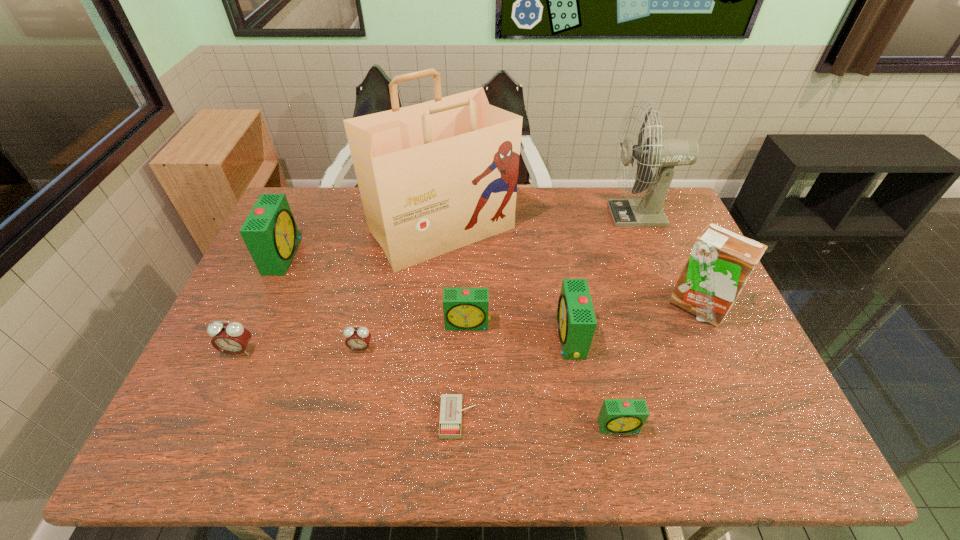
Find the location of a particular element. This screenshot has height=540, width=960. free region at the far left corner of the desktop is located at coordinates pyautogui.click(x=325, y=198).

Identify the location of free region at the near left corner of the desktop. Image resolution: width=960 pixels, height=540 pixels. (179, 431).

Locate an element on the screen. This screenshot has height=540, width=960. vacant space at the far right corner is located at coordinates (672, 197).

Locate an element on the screen. The width and height of the screenshot is (960, 540). vacant space that's between the second tallest alarm clock and the bigger pink alarm clock is located at coordinates (404, 344).

Locate an element on the screen. free spot between the fourth tallest object and the eighth shortest object is located at coordinates (490, 281).

Locate an element on the screen. empty space that is in between the third alarm clock from left to right and the matchbox is located at coordinates tap(410, 383).

What are the coordinates of `vacant point located between the biggest green alarm clock and the second biggest green alarm clock` in the screenshot? It's located at (426, 296).

The width and height of the screenshot is (960, 540). Identify the location of free space between the right pink alarm clock and the carton. (529, 327).

Find the location of a particular element. This screenshot has height=540, width=960. empty space that is in between the fan and the second biggest green alarm clock is located at coordinates (605, 276).

You are a GUI agent. You are given a task and a screenshot of the screen. Output one action in this format:
    pyautogui.click(x=<x>, y=<y>)
    Task: Click on the free space that is in between the nearest green alarm clock and the fan
    Image resolution: width=960 pixels, height=540 pixels.
    Given the screenshot: What is the action you would take?
    [629, 320]